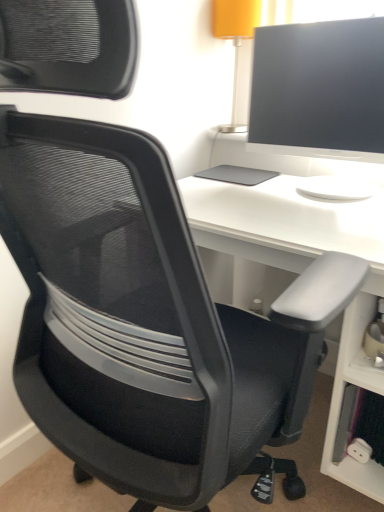
In order to click on vacant space situated on the left part of matte black monitor at upper right in this screenshot , I will do `click(242, 190)`.